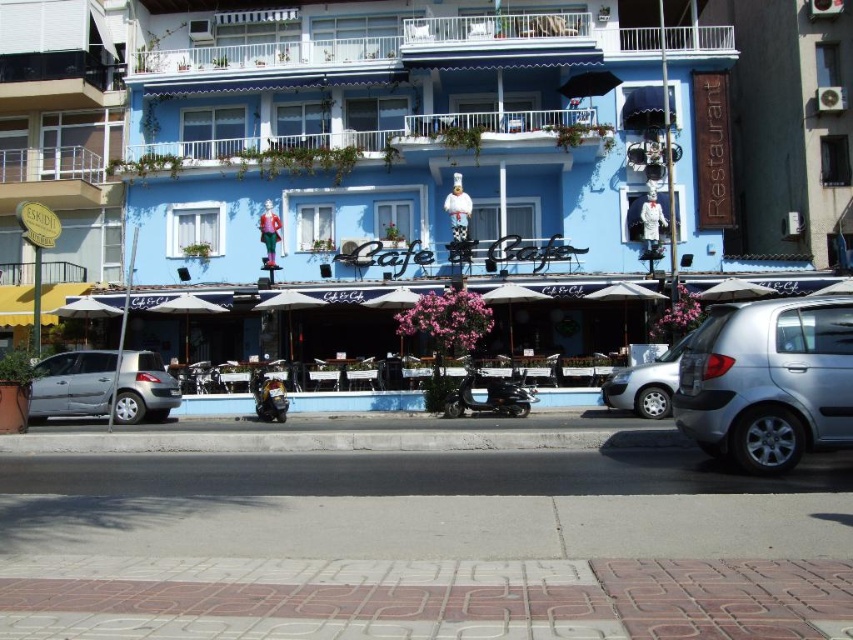
Does silver metallic car at right appear on the right side of silver metallic car at left?

Indeed, silver metallic car at right is positioned on the right side of silver metallic car at left.

Locate an element on the screen. silver metallic car at right is located at coordinates (769, 381).

The width and height of the screenshot is (853, 640). In order to click on silver metallic car at right in this screenshot , I will do `click(769, 381)`.

Does blue matte building at center have a smaller size compared to black matte scooter at center?

Actually, blue matte building at center might be larger than black matte scooter at center.

The image size is (853, 640). I want to click on blue matte building at center, so coord(416,163).

Consider the image. Is yellow awning at left thinner than silver metallic car at center?

No, yellow awning at left is not thinner than silver metallic car at center.

Does yellow awning at left lie behind silver metallic car at center?

Yes.

You are a GUI agent. You are given a task and a screenshot of the screen. Output one action in this format:
    pyautogui.click(x=<x>, y=<y>)
    Task: Click on the yellow awning at left
    
    Given the screenshot: What is the action you would take?
    pyautogui.click(x=59, y=150)